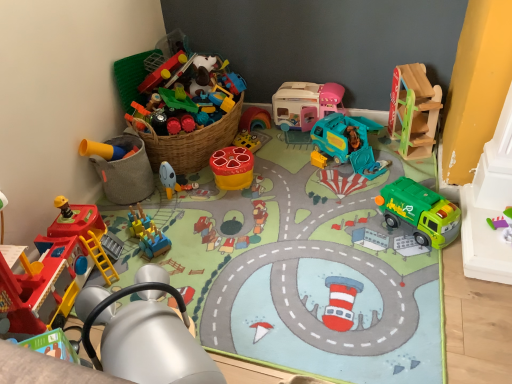
Identify the location of free area in between matte plastic stool at center, the fifth toy from the left, and blue plastic train at center, which appears as the 2th toy when viewed from the left. The width and height of the screenshot is (512, 384). (197, 207).